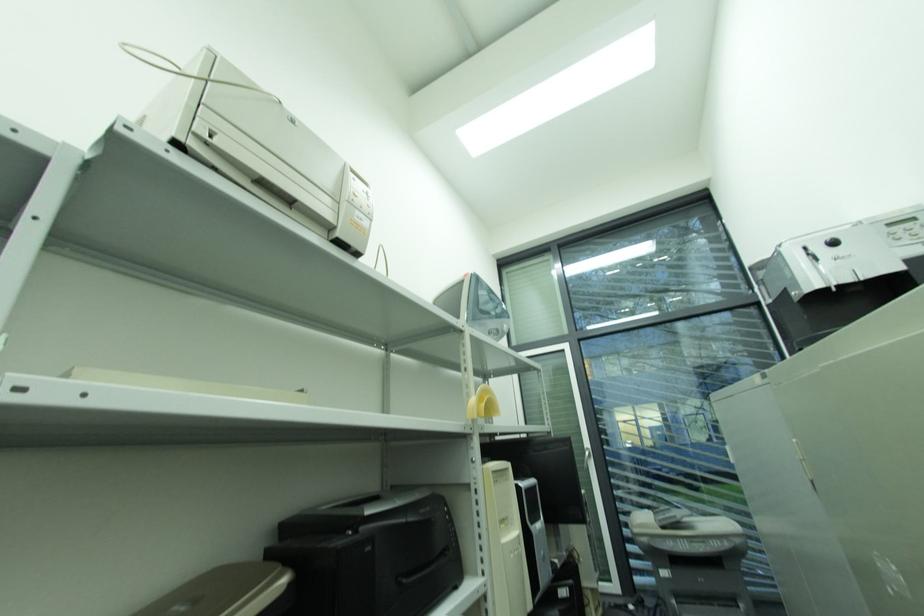
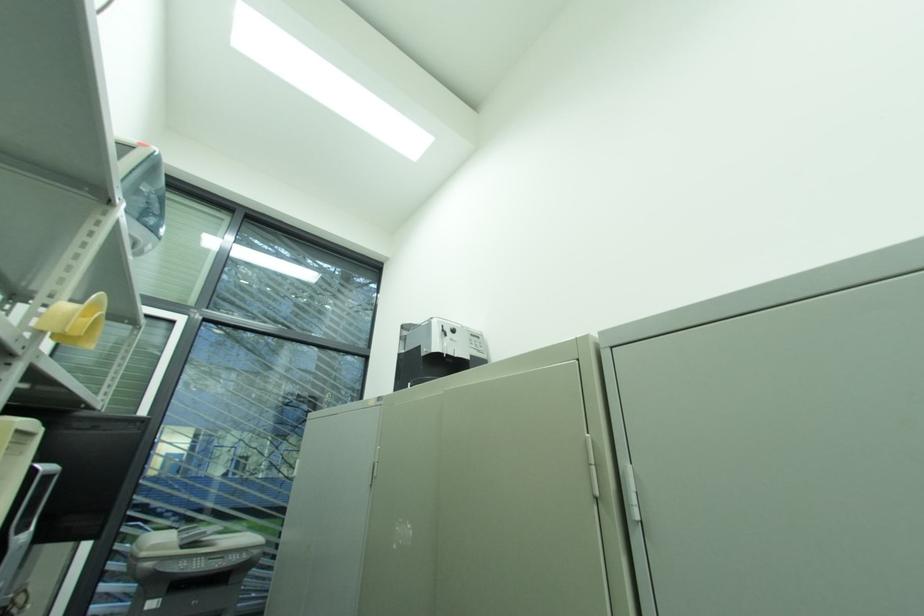
How did the camera likely rotate?

The camera rotated toward right-up.